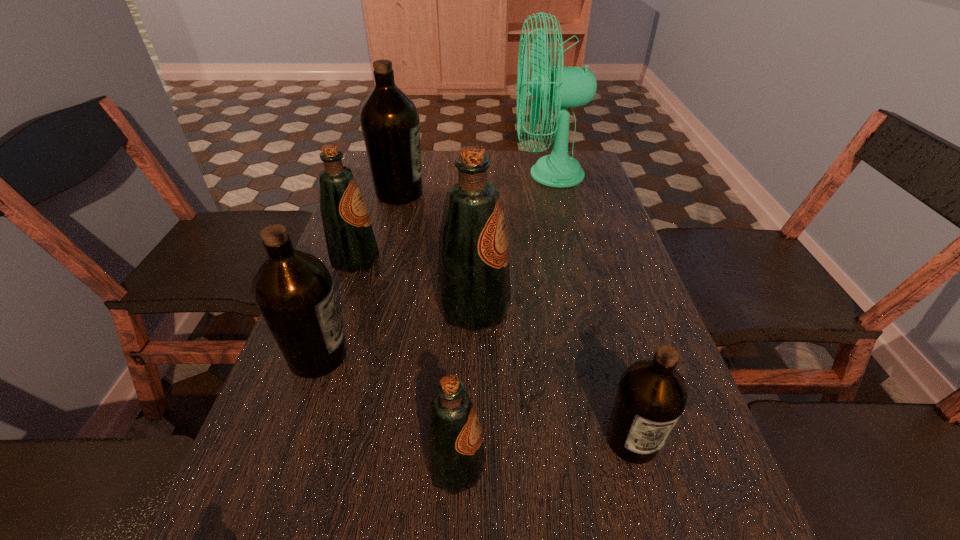
I want to click on fan, so click(568, 87).

What are the coordinates of `the tallest object` in the screenshot? It's located at (568, 87).

The image size is (960, 540). I want to click on the second nearest green olive oil, so click(474, 293).

The height and width of the screenshot is (540, 960). In order to click on the biggest brown olive oil in this screenshot , I will do `click(389, 120)`.

Find the location of a particular element. the farthest brown olive oil is located at coordinates (389, 120).

Image resolution: width=960 pixels, height=540 pixels. Find the location of `the leftmost green olive oil`. the leftmost green olive oil is located at coordinates (350, 241).

In order to click on the farthest green olive oil in this screenshot , I will do `click(350, 241)`.

Where is `the second biggest brown olive oil`? The width and height of the screenshot is (960, 540). the second biggest brown olive oil is located at coordinates (293, 290).

Identify the location of the nearest green olive oil. This screenshot has width=960, height=540. (454, 452).

The width and height of the screenshot is (960, 540). Identify the location of the rightmost olive oil. (652, 395).